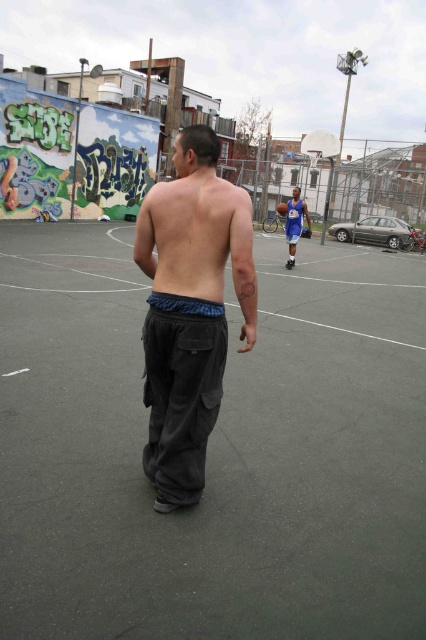
Is dark gray asphalt court at center to the left of dark gray cargo pants at center from the viewer's perspective?

In fact, dark gray asphalt court at center is to the right of dark gray cargo pants at center.

Does point (106, 266) come closer to viewer compared to point (222, 372)?

No, (106, 266) is further to viewer.

Between point (8, 449) and point (158, 444), which one is positioned in front?

Point (158, 444) is in front.

Identify the location of dark gray asphalt court at center. Image resolution: width=426 pixels, height=640 pixels. (213, 451).

Is blue fabric at lower center above blue jersey at center?

Incorrect, blue fabric at lower center is not positioned above blue jersey at center.

Does blue fabric at lower center have a larger size compared to blue jersey at center?

Actually, blue fabric at lower center might be smaller than blue jersey at center.

Is point (196, 308) behind point (299, 221)?

No.

Find the location of `blue fabric at lower center`. blue fabric at lower center is located at coordinates (184, 305).

Can you confirm if dark gray asphalt court at center is shorter than shiny blue basketball at center?

In fact, dark gray asphalt court at center may be taller than shiny blue basketball at center.

Who is positioned more to the right, dark gray asphalt court at center or shiny blue basketball at center?

shiny blue basketball at center is more to the right.

Is point (406, 616) behind point (281, 202)?

That is False.

This screenshot has height=640, width=426. Identify the location of dark gray asphalt court at center. (213, 451).